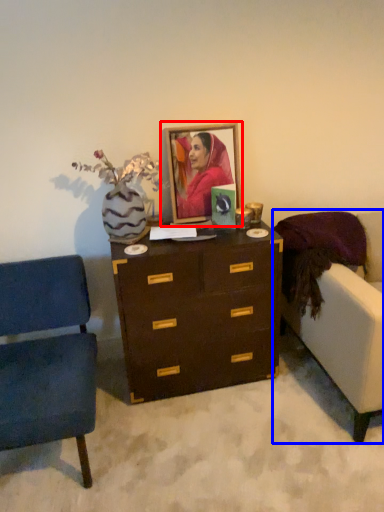
Question: Which object appears farthest to the camera in this image, picture frame (highlighted by a red box) or studio couch (highlighted by a blue box)?

Choices:
 (A) picture frame
 (B) studio couch

Answer: (A)